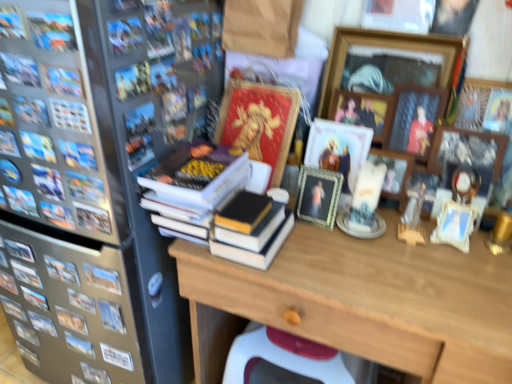
The height and width of the screenshot is (384, 512). Identify the location of unoccupied area in front of green textured frame at center, placed as the first picture frame when sorted from left to right. pyautogui.click(x=335, y=266).